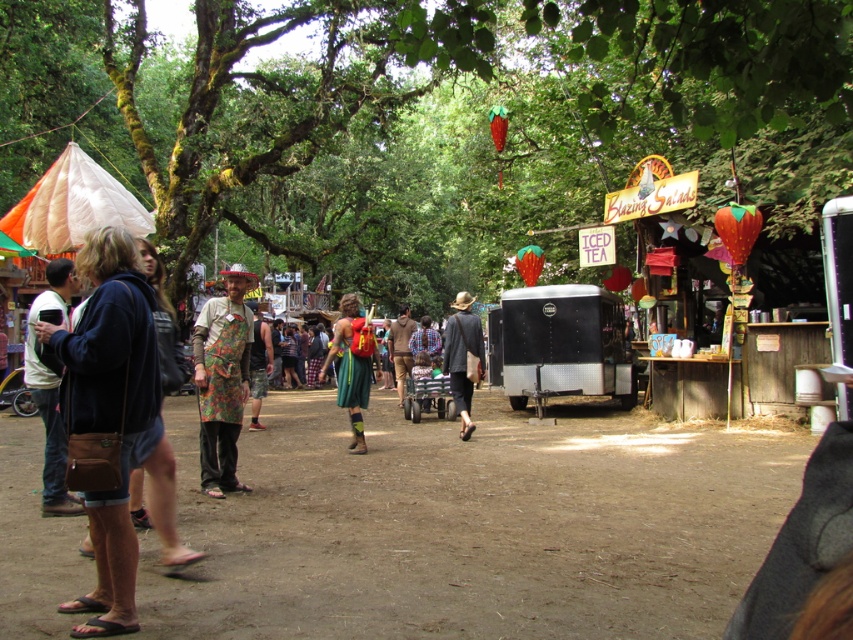
Is green leafy tree at center shorter than floral fabric apron at center?

In fact, green leafy tree at center may be taller than floral fabric apron at center.

From the picture: Is green leafy tree at center above floral fabric apron at center?

Indeed, green leafy tree at center is positioned over floral fabric apron at center.

Which is in front, point (601, 188) or point (218, 452)?

Point (218, 452) is more forward.

Locate an element on the screen. The height and width of the screenshot is (640, 853). green leafy tree at center is located at coordinates (427, 124).

Is black metal trailer at center in front of brown fabric shirt at center?

Yes, it is.

Consider the image. Between black metal trailer at center and brown fabric shirt at center, which one appears on the right side from the viewer's perspective?

From the viewer's perspective, black metal trailer at center appears more on the right side.

Does point (502, 380) come closer to viewer compared to point (387, 344)?

That is True.

The width and height of the screenshot is (853, 640). Find the location of `black metal trailer at center`. black metal trailer at center is located at coordinates (564, 342).

The image size is (853, 640). What do you see at coordinates (564, 342) in the screenshot?
I see `black metal trailer at center` at bounding box center [564, 342].

Can you confirm if black metal trailer at center is smaller than matte brown hat at center?

Actually, black metal trailer at center might be larger than matte brown hat at center.

Is point (607, 381) closer to camera compared to point (471, 394)?

Yes.

Where is `black metal trailer at center`? Image resolution: width=853 pixels, height=640 pixels. black metal trailer at center is located at coordinates coord(564,342).